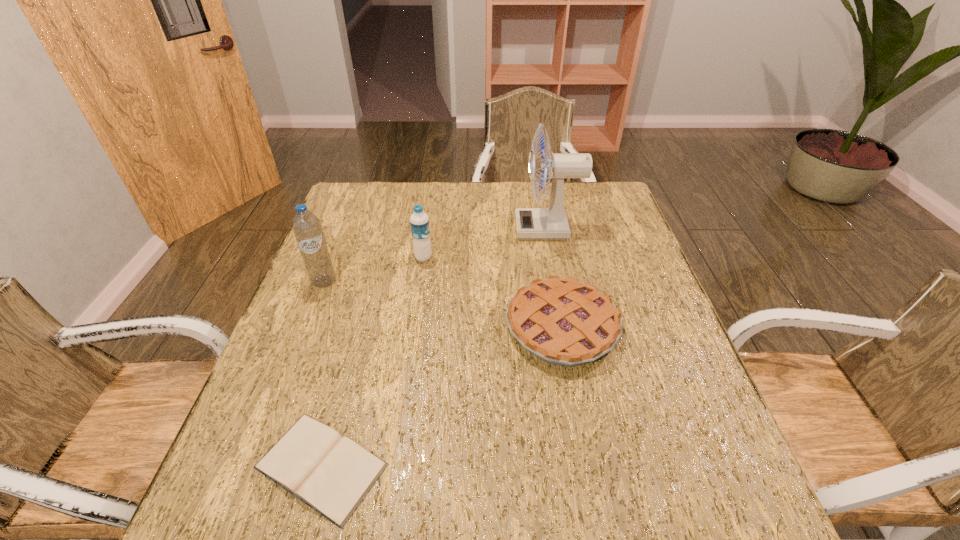
At what (x,y) coordinates should I click in order to perform the action: click on free space located 0.200m on the front-facing side of the farthest object. Please return your answer as a coordinate pair (x, y). Looking at the image, I should click on (450, 228).

Image resolution: width=960 pixels, height=540 pixels. Find the location of `vacant space positioned 0.110m on the front-facing side of the farthest object`. vacant space positioned 0.110m on the front-facing side of the farthest object is located at coordinates (480, 228).

Where is `vacant region located on the back of the fourth shortest object`? vacant region located on the back of the fourth shortest object is located at coordinates (355, 201).

The height and width of the screenshot is (540, 960). In order to click on vacant space located 0.160m on the label of the third shortest object in this screenshot , I will do point(490,258).

Where is `vacant point located on the left of the fourth tallest object`? This screenshot has width=960, height=540. vacant point located on the left of the fourth tallest object is located at coordinates (470, 328).

The height and width of the screenshot is (540, 960). In order to click on vacant space positioned 0.340m on the back of the Bible in this screenshot , I will do `click(368, 295)`.

I want to click on object that is at the far edge, so click(531, 223).

The width and height of the screenshot is (960, 540). I want to click on object at the near edge, so click(332, 474).

I want to click on water bottle that is at the left edge, so click(x=307, y=228).

What are the coordinates of `Bible that is at the left edge` in the screenshot? It's located at (332, 474).